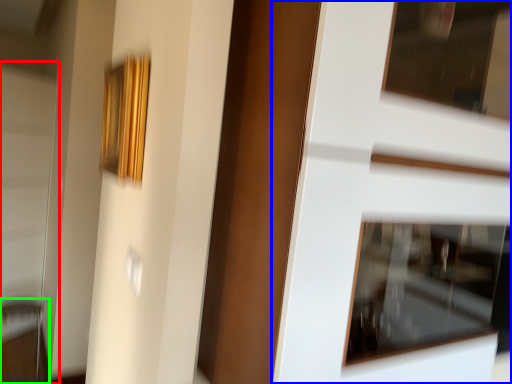
Question: Which object is the closest to the screen door (highlighted by a red box)? Choose among these: door (highlighted by a blue box) or furniture (highlighted by a green box).

Choices:
 (A) door
 (B) furniture

Answer: (B)